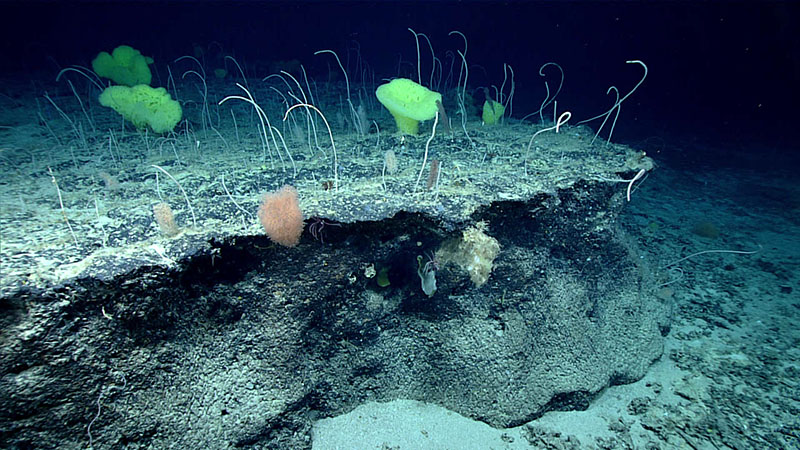
Locate an element on the screen. pink sponge is located at coordinates (282, 218).